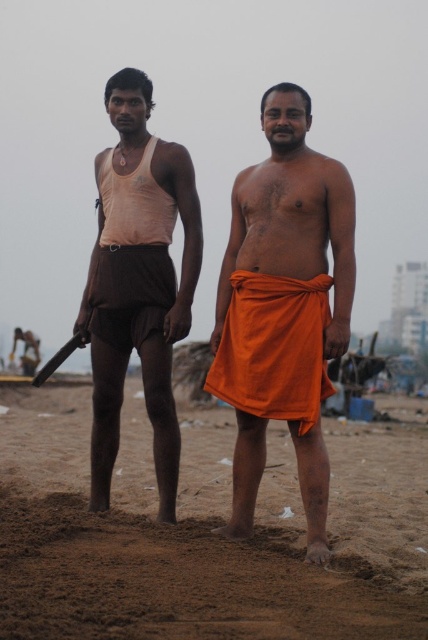
You are a photographer trying to capture a photo of the orange cloth at center and the matte brown shorts at left. Based on their positions, which object should you focus on first if you want to include both in the frame without moving the camera?

The orange cloth at center is positioned on the right side of matte brown shorts at left, so you should focus on the matte brown shorts at left first since it is closer to the left side and will be in the frame naturally when including both.

Consider the image. You are a photographer standing at the point marked by the coordinates point (207,531). You want to take a photo of the two individuals in the scene. Which direction should you move to ensure both are fully visible in your frame?

The point (207,531) marks the brown sandy feet at lower center. To ensure both individuals are fully visible, you should move backward away from the lower center to capture them in the frame.

You are a photographer positioned at the back of the scene. You want to capture a photo where both the orange cloth at center and the matte brown shorts at left are visible. Which object should you adjust your focus to ensure both are in frame?

Since the orange cloth at center is in front of the matte brown shorts at left, you should focus on the orange cloth at center to ensure both are visible in the frame.